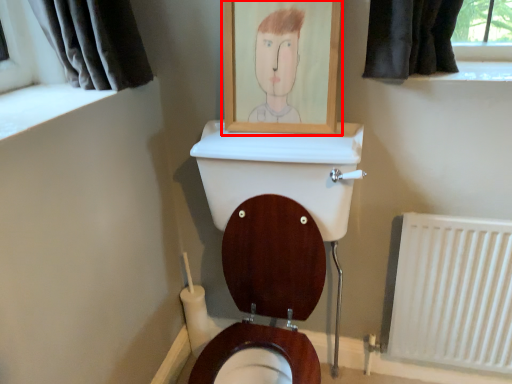
Question: Considering the relative positions of picture frame (annotated by the red box) and radiator in the image provided, where is picture frame (annotated by the red box) located with respect to the staircase?

Choices:
 (A) left
 (B) right

Answer: (A)